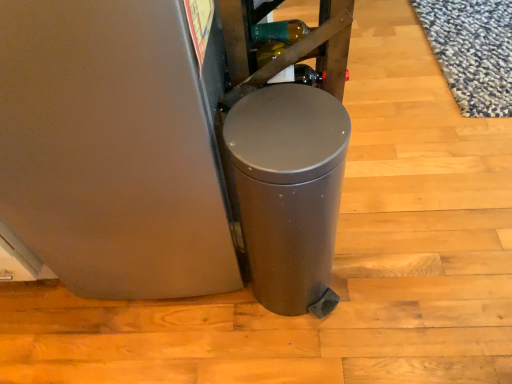
Locate an element on the screen. blank space situated above satin metallic trash can at center (from a real-world perspective) is located at coordinates (285, 129).